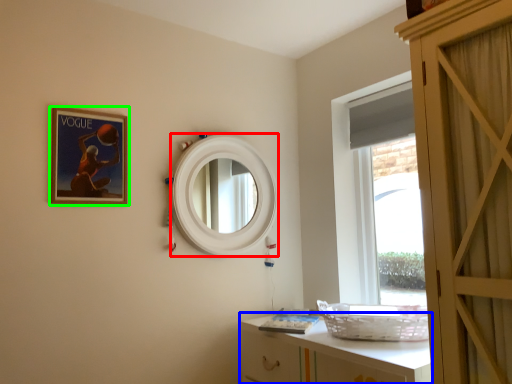
Question: Estimate the real-world distances between objects in this image. Which object is closer to mirror (highlighted by a red box), cabinetry (highlighted by a blue box) or picture frame (highlighted by a green box)?

Choices:
 (A) cabinetry
 (B) picture frame

Answer: (B)